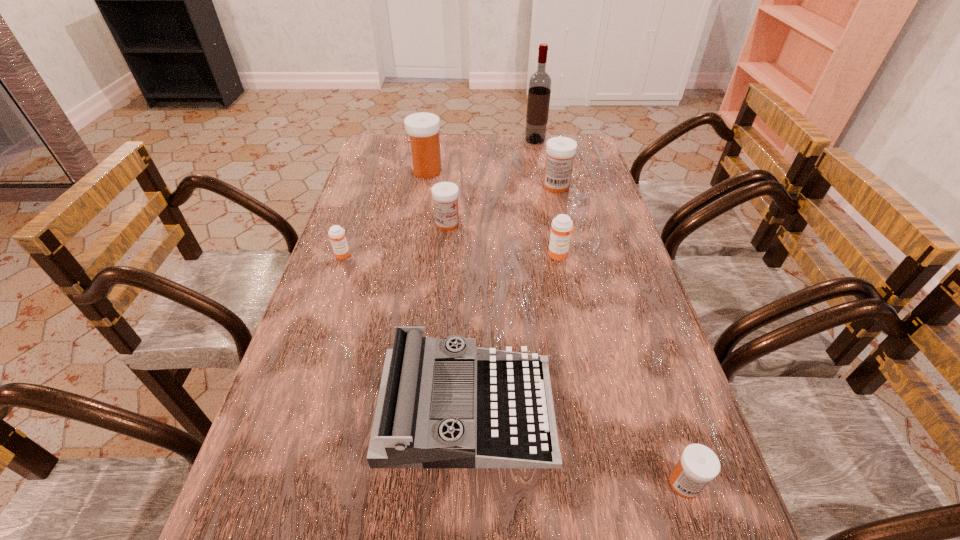
What are the coordinates of `medicine that is the third closest to the typewriter` in the screenshot? It's located at (336, 233).

Select which white medicine is the closest to the second nearest white medicine. Please provide its 2D coordinates. Your answer should be formatted as a tuple, i.e. [(x, y)], where the tuple contains the x and y coordinates of a point satisfying the conditions above.

[(422, 128)]

Where is `the third closest white medicine to the nearest medicine`? the third closest white medicine to the nearest medicine is located at coordinates (422, 128).

Where is `free space that satisfies the following two spatial constraints: 1. on the back side of the wine bottle; 2. on the left side of the biggest white medicine`? Image resolution: width=960 pixels, height=540 pixels. free space that satisfies the following two spatial constraints: 1. on the back side of the wine bottle; 2. on the left side of the biggest white medicine is located at coordinates (431, 140).

Image resolution: width=960 pixels, height=540 pixels. Find the location of `free region that satisfies the following two spatial constraints: 1. on the typing side of the smallest white medicine; 2. on the left side of the typewriter`. free region that satisfies the following two spatial constraints: 1. on the typing side of the smallest white medicine; 2. on the left side of the typewriter is located at coordinates (466, 483).

Locate an element on the screen. This screenshot has height=540, width=960. vacant space that satisfies the following two spatial constraints: 1. on the front side of the nearest white medicine; 2. on the left side of the second tallest medicine is located at coordinates (624, 483).

Find the location of a particular element. The image size is (960, 540). vacant space that satisfies the following two spatial constraints: 1. on the front side of the wine bottle; 2. on the typing side of the black typewriter is located at coordinates (586, 409).